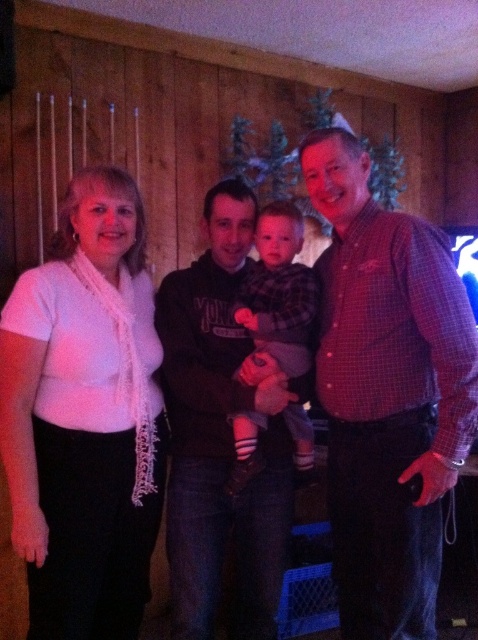
You are trying to decide which item to reach for first based on their height. You see the white lace scarf at left and the dark brown hoodie at center. Which one is shorter?

The white lace scarf at left is shorter than the dark brown hoodie at center, so you should reach for the white lace scarf at left first if you want to pick the shorter one.

You are a photographer adjusting the lighting in the room. You notice the dark brown hoodie at center and the flannel shirt at center. Which clothing item should you focus on to ensure it receives more light since it might be in shadow?

The dark brown hoodie at center is in front of the flannel shirt at center, so you should focus on the flannel shirt at center to ensure it receives more light since it might be in shadow.

You are an interior designer analyzing the composition of this family portrait. Based on the coordinates provided, where exactly is the white lace scarf at left positioned in the image?

The white lace scarf at left is positioned at the coordinates point (85, 417).